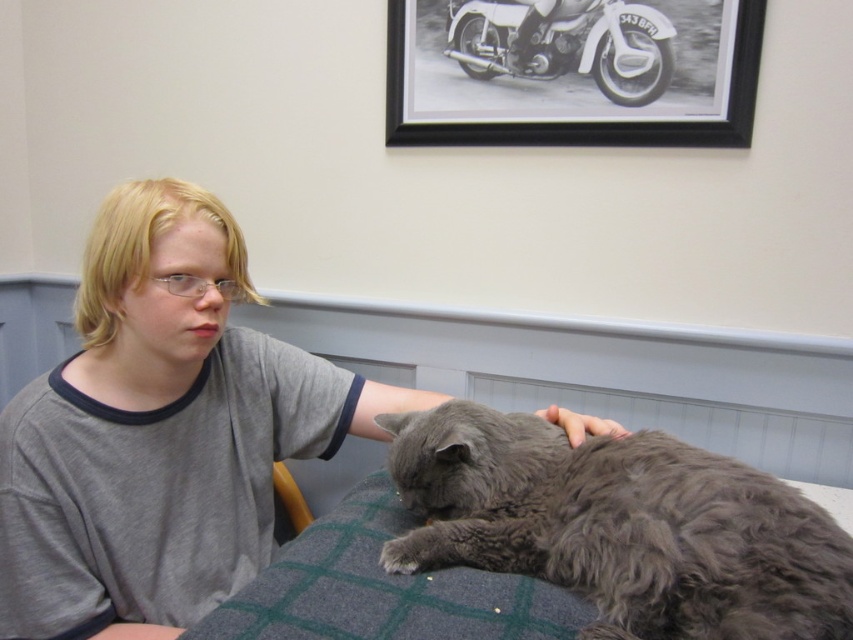
Question: Which point is closer to the camera?

Choices:
 (A) (289, 480)
 (B) (486, 12)
 (C) (267, 502)

Answer: (C)

Question: Does gray soft fabric at left lie in front of white matte motorbike at upper center?

Choices:
 (A) yes
 (B) no

Answer: (A)

Question: Where is gray fluffy cat at lower right located in relation to black matte picture frame at upper center in the image?

Choices:
 (A) left
 (B) right

Answer: (A)

Question: Is gray soft shirt at center positioned behind black matte picture frame at upper center?

Choices:
 (A) no
 (B) yes

Answer: (A)

Question: Which object is the farthest from the white matte motorbike at upper center?

Choices:
 (A) gray soft fabric at left
 (B) gray fluffy cat at lower right
 (C) gray soft shirt at center
 (D) black matte picture frame at upper center

Answer: (A)

Question: Which object is the farthest from the gray fluffy cat at lower right?

Choices:
 (A) black matte picture frame at upper center
 (B) white matte motorbike at upper center
 (C) yellow leather chair at lower left
 (D) gray soft shirt at center

Answer: (B)